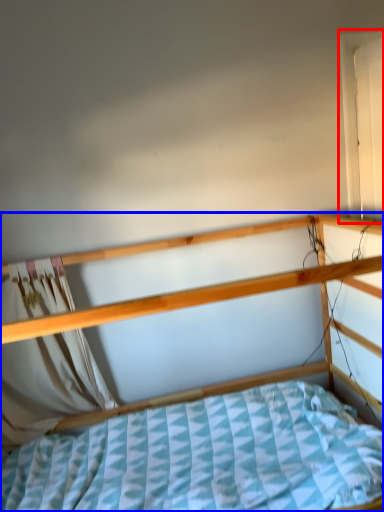
Question: Which of the following is the closest to the observer, window (highlighted by a red box) or bed (highlighted by a blue box)?

Choices:
 (A) window
 (B) bed

Answer: (B)